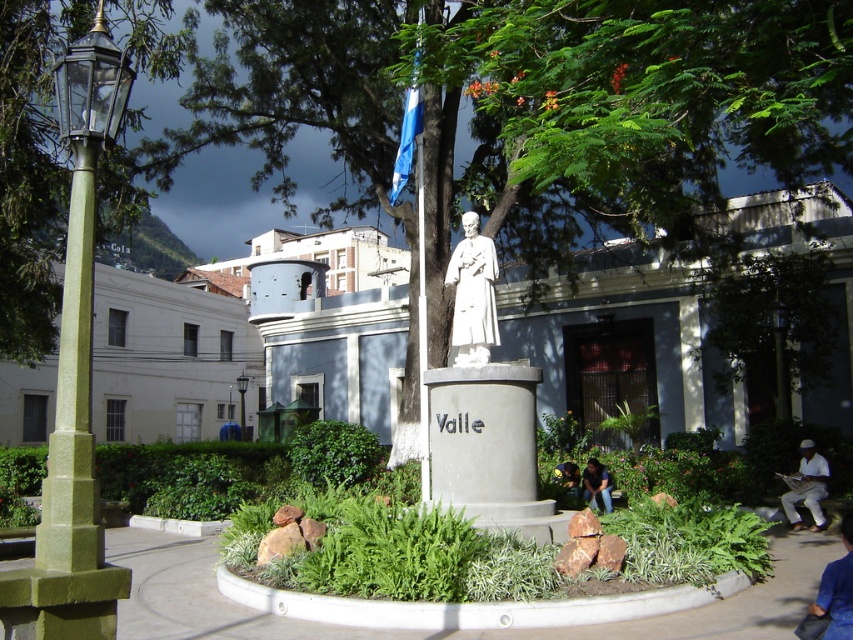
You are a photographer wanting to capture the white marble statue at center and the blue fabric pants at lower right in the same frame. Based on their sizes, which object should you focus on to ensure both are visible without zooming in or out?

The white marble statue at center is much taller than the blue fabric pants at lower right, so you should focus on the white marble statue at center to ensure both are visible without needing to adjust the zoom.

You are standing at the center of the park looking towards the statue. Which direction should you turn to face the green leafy tree at left?

The green leafy tree at left is located at the left side of the scene, so you should turn to your left to face it.